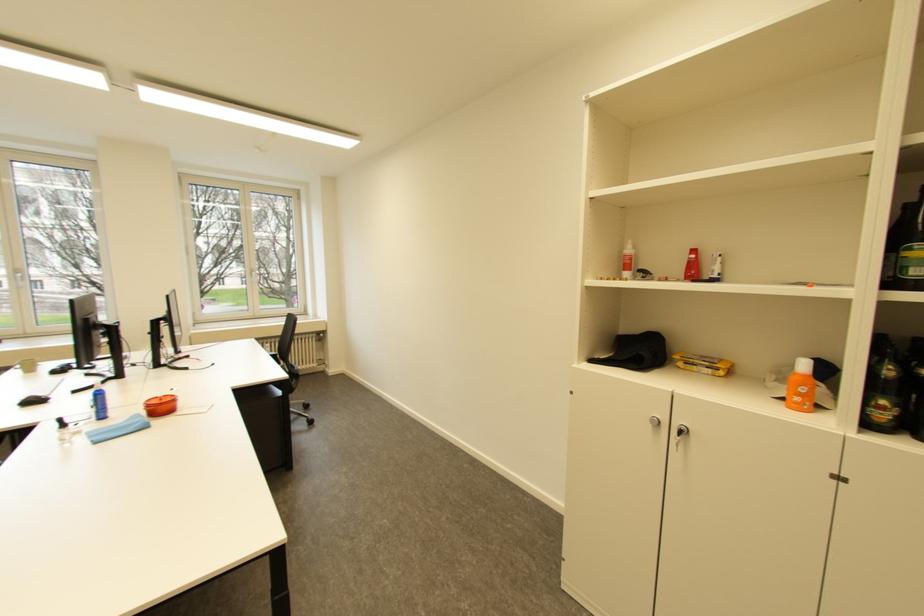
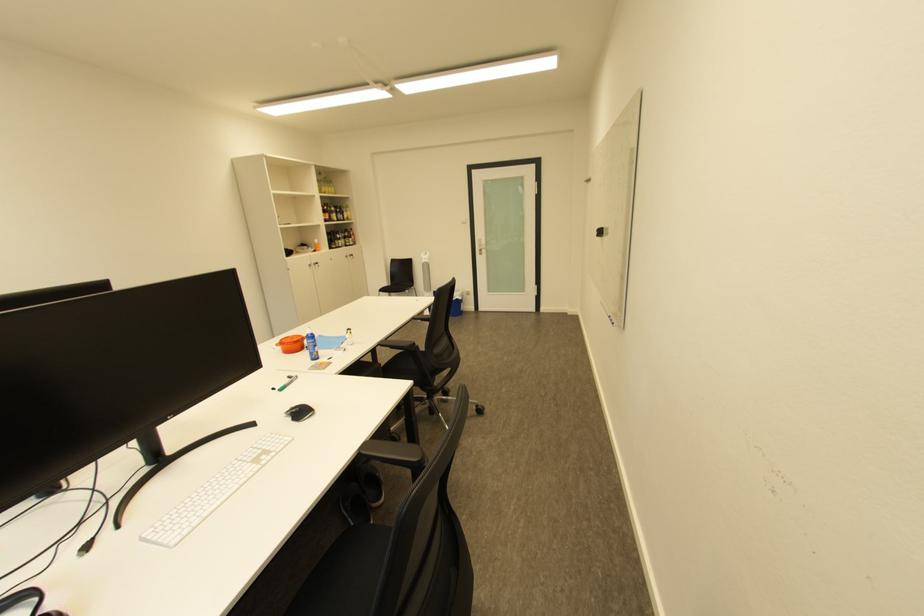
Locate, in the second image, the point that corresponds to (x=895, y=309) in the first image.

(335, 225)